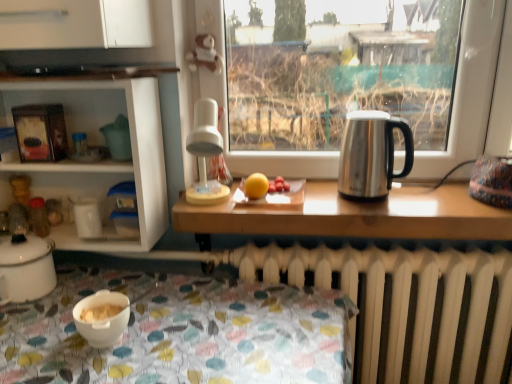
Question: Is smooth red tomatoes at center not inside white matte bowl at lower left?

Choices:
 (A) no
 (B) yes

Answer: (B)

Question: Does smooth red tomatoes at center have a greater height compared to white matte bowl at lower left?

Choices:
 (A) no
 (B) yes

Answer: (A)

Question: Can you confirm if smooth red tomatoes at center is shorter than white matte bowl at lower left?

Choices:
 (A) no
 (B) yes

Answer: (B)

Question: Does smooth red tomatoes at center come in front of white matte bowl at lower left?

Choices:
 (A) yes
 (B) no

Answer: (B)

Question: Are smooth red tomatoes at center and white matte bowl at lower left far apart?

Choices:
 (A) no
 (B) yes

Answer: (A)

Question: From the image's perspective, is smooth red tomatoes at center above white matte bowl at lower left?

Choices:
 (A) no
 (B) yes

Answer: (B)

Question: Is smooth red tomatoes at center not inside white glossy shelves at left?

Choices:
 (A) no
 (B) yes

Answer: (B)

Question: From the image's perspective, would you say smooth red tomatoes at center is shown under white glossy shelves at left?

Choices:
 (A) yes
 (B) no

Answer: (A)

Question: Considering the relative sizes of smooth red tomatoes at center and white glossy shelves at left in the image provided, is smooth red tomatoes at center thinner than white glossy shelves at left?

Choices:
 (A) yes
 (B) no

Answer: (A)

Question: Would you say white glossy shelves at left is part of smooth red tomatoes at center's contents?

Choices:
 (A) no
 (B) yes

Answer: (A)

Question: Is smooth red tomatoes at center wider than white glossy shelves at left?

Choices:
 (A) no
 (B) yes

Answer: (A)

Question: From a real-world perspective, is smooth red tomatoes at center on white glossy shelves at left?

Choices:
 (A) no
 (B) yes

Answer: (A)

Question: Considering the relative positions of white plastic lamp at center and smooth red tomatoes at center in the image provided, is white plastic lamp at center behind smooth red tomatoes at center?

Choices:
 (A) no
 (B) yes

Answer: (A)